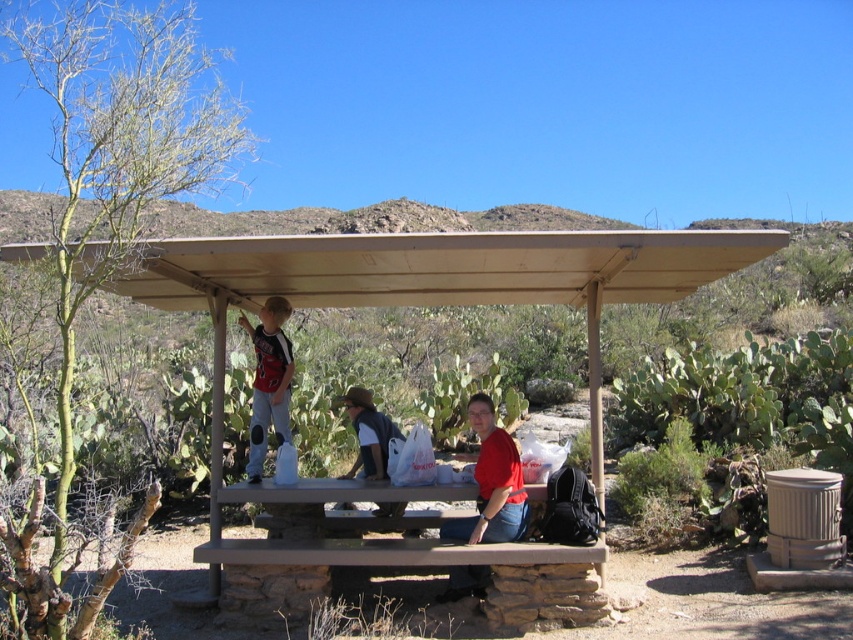
You are planning to take a photo of the scene inside the picnic shelter. You want to ensure both the red matte shirt at lower center and the denim jacket at lower center are visible in the frame. Based on their positions, which object should be closer to the left side of your photo?

The denim jacket at lower center is to the left of the red matte shirt at lower center, so in the photo, the denim jacket at lower center would appear closer to the left side.

In the scene shown: You are standing at the entrance of the brown wooden picnic shelter and want to place your backpack on the nearest available surface. Which object should you choose between the brown wooden picnic table at center and the denim jacket at lower center?

The denim jacket at lower center is closer to the entrance since it is positioned to the left of the brown wooden picnic table at center. Place your backpack on the denim jacket at lower center.